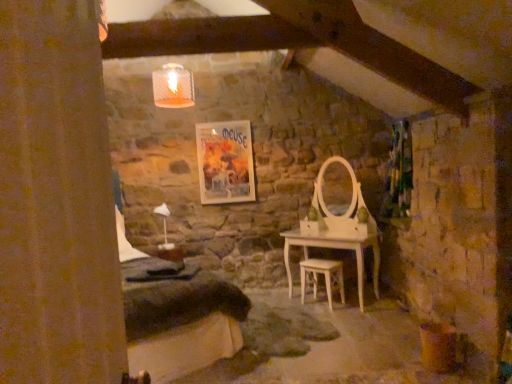
Question: Considering the relative positions of matte paper poster at center and light wood stool at center in the image provided, is matte paper poster at center to the right of light wood stool at center from the viewer's perspective?

Choices:
 (A) no
 (B) yes

Answer: (A)

Question: Is matte paper poster at center thinner than light wood stool at center?

Choices:
 (A) yes
 (B) no

Answer: (A)

Question: Is matte paper poster at center positioned with its back to light wood stool at center?

Choices:
 (A) no
 (B) yes

Answer: (A)

Question: Can we say matte paper poster at center lies outside light wood stool at center?

Choices:
 (A) yes
 (B) no

Answer: (A)

Question: Could you tell me if matte paper poster at center is turned towards light wood stool at center?

Choices:
 (A) no
 (B) yes

Answer: (A)

Question: From the image's perspective, is matte paper poster at center below light wood stool at center?

Choices:
 (A) yes
 (B) no

Answer: (B)

Question: Can you confirm if matte paper poster at center is wider than brown textured curtain at left, which ranks as the 1th curtain in left-to-right order?

Choices:
 (A) yes
 (B) no

Answer: (B)

Question: Is the depth of matte paper poster at center less than that of brown textured curtain at left, which is the second curtain in back-to-front order?

Choices:
 (A) yes
 (B) no

Answer: (B)

Question: Is matte paper poster at center facing towards brown textured curtain at left, arranged as the second curtain when viewed from the right?

Choices:
 (A) yes
 (B) no

Answer: (A)

Question: Considering the relative sizes of matte paper poster at center and brown textured curtain at left, the first curtain when ordered from front to back, in the image provided, is matte paper poster at center shorter than brown textured curtain at left, the first curtain when ordered from front to back,?

Choices:
 (A) no
 (B) yes

Answer: (B)

Question: Are matte paper poster at center and brown textured curtain at left, the first curtain when ordered from front to back, making contact?

Choices:
 (A) yes
 (B) no

Answer: (B)

Question: Does matte paper poster at center have a lesser width compared to brown textured curtain at left, arranged as the second curtain when viewed from the right?

Choices:
 (A) yes
 (B) no

Answer: (A)

Question: From the image's perspective, does light wood stool at center appear lower than matte paper poster at center?

Choices:
 (A) no
 (B) yes

Answer: (B)